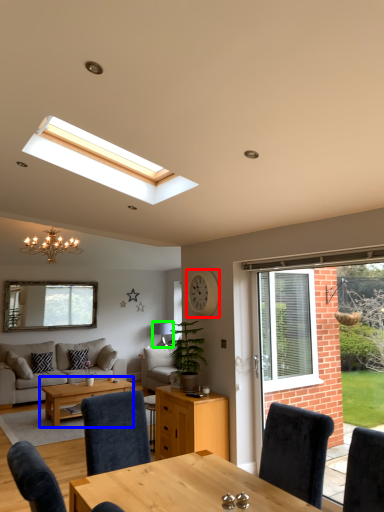
Question: Which object is positioned farthest from clock (highlighted by a red box)? Select from coffee table (highlighted by a blue box) and lamp (highlighted by a green box).

Choices:
 (A) coffee table
 (B) lamp

Answer: (B)